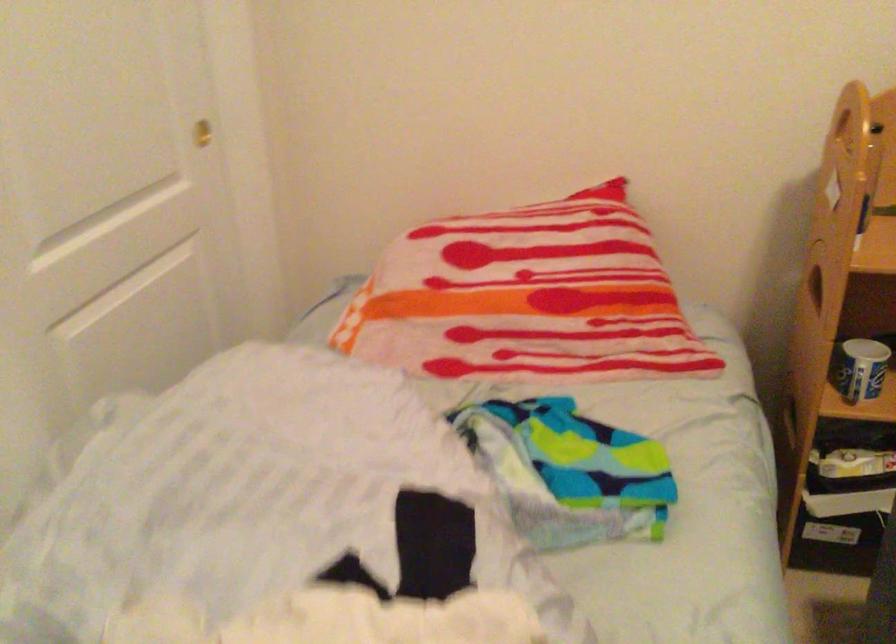
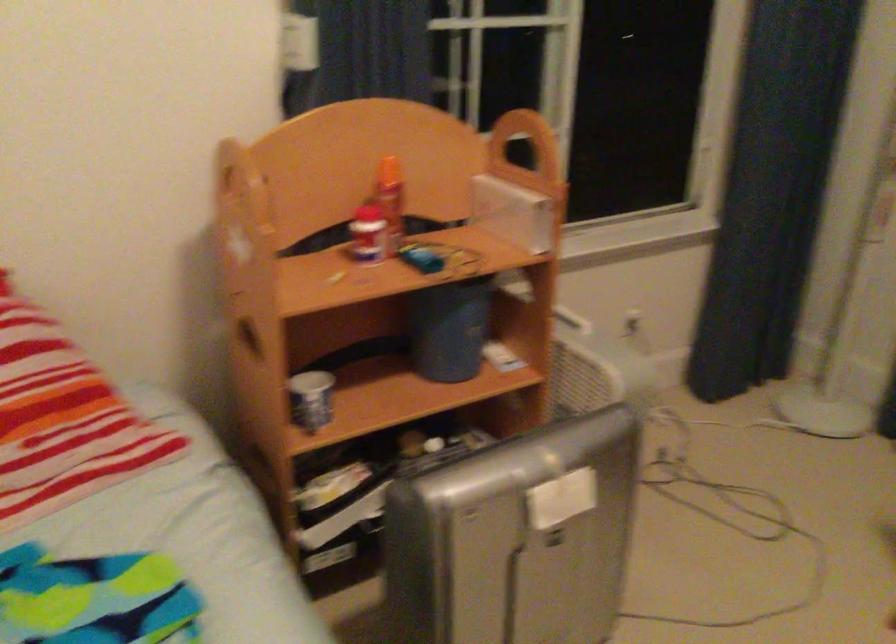
Question: The camera is either moving clockwise (left) or counter-clockwise (right) around the object. The first image is from the beginning of the video and the second image is from the end. Is the camera moving left or right when shooting the video?

Choices:
 (A) Left
 (B) Right

Answer: (A)